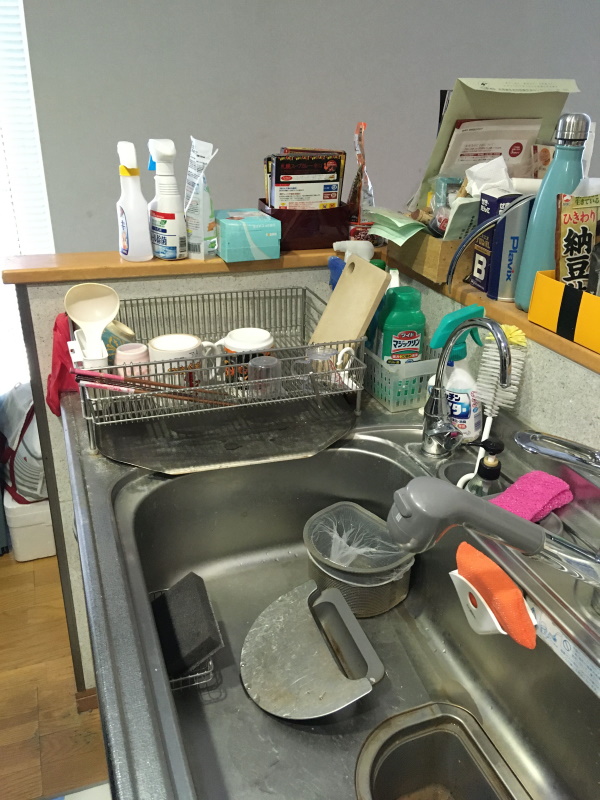
Where is `dish brush`? The height and width of the screenshot is (800, 600). dish brush is located at coordinates (489, 397).